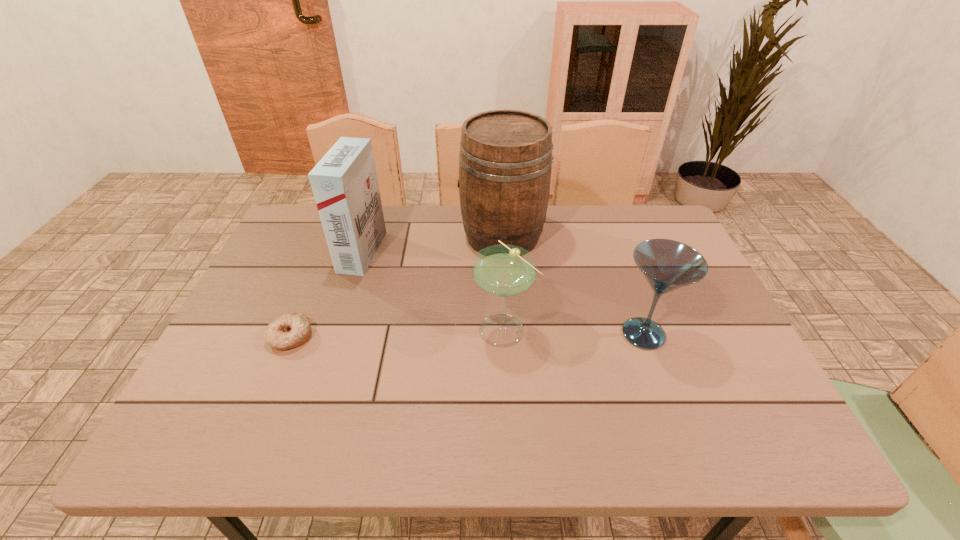
You are a GUI agent. You are given a task and a screenshot of the screen. Output one action in this format:
    pyautogui.click(x=<x>, y=<y>)
    Task: Click on the free space at the near left corner of the desktop
    The width and height of the screenshot is (960, 540).
    Given the screenshot: What is the action you would take?
    pyautogui.click(x=246, y=446)

Image resolution: width=960 pixels, height=540 pixels. In the image, there is a desktop. Find the location of `vacant space at the far right corner`. vacant space at the far right corner is located at coordinates click(x=661, y=234).

At what (x,y) coordinates should I click in order to perform the action: click on free region at the near right corner of the desktop. Please return your answer as a coordinate pair (x, y). This screenshot has height=540, width=960. Looking at the image, I should click on (746, 431).

The width and height of the screenshot is (960, 540). Find the location of `vacant space in between the left martini and the doughnut`. vacant space in between the left martini and the doughnut is located at coordinates (397, 333).

Find the location of a particular element. vacant space that's between the cigarette case and the shortest object is located at coordinates (326, 294).

Image resolution: width=960 pixels, height=540 pixels. In order to click on free spot between the doughnut and the right martini in this screenshot , I will do `click(468, 335)`.

The width and height of the screenshot is (960, 540). Identify the location of empty location between the cider and the right martini. (573, 285).

Locate an element on the screen. Image resolution: width=960 pixels, height=540 pixels. free space between the cider and the doughnut is located at coordinates (396, 287).

The width and height of the screenshot is (960, 540). Find the location of `free area in between the doughnut and the cider`. free area in between the doughnut and the cider is located at coordinates (396, 287).

Where is `free space between the cigarette case and the shortest object`? This screenshot has width=960, height=540. free space between the cigarette case and the shortest object is located at coordinates (326, 294).